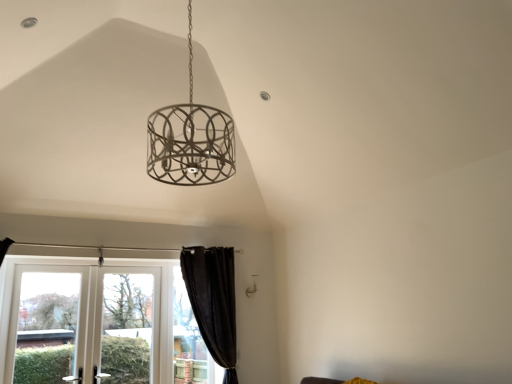
Question: Can you confirm if clear glass screen door at lower left is shorter than black curtain at lower left, acting as the 3th window starting from the left?

Choices:
 (A) no
 (B) yes

Answer: (B)

Question: From a real-world perspective, is clear glass screen door at lower left located higher than black curtain at lower left, acting as the 3th window starting from the left?

Choices:
 (A) yes
 (B) no

Answer: (A)

Question: Can you confirm if clear glass screen door at lower left is taller than black curtain at lower left, which is counted as the first window, starting from the right?

Choices:
 (A) no
 (B) yes

Answer: (A)

Question: Can you confirm if clear glass screen door at lower left is smaller than black curtain at lower left, acting as the 3th window starting from the left?

Choices:
 (A) no
 (B) yes

Answer: (A)

Question: Considering the relative positions of clear glass screen door at lower left and black curtain at lower left, which is counted as the first window, starting from the right, in the image provided, is clear glass screen door at lower left to the right of black curtain at lower left, which is counted as the first window, starting from the right, from the viewer's perspective?

Choices:
 (A) yes
 (B) no

Answer: (B)

Question: Is clear glass screen door at lower left bigger than black curtain at lower left, acting as the 3th window starting from the left?

Choices:
 (A) no
 (B) yes

Answer: (B)

Question: Is clear glass screen door at lower left aimed at black velvet curtain at lower left?

Choices:
 (A) yes
 (B) no

Answer: (B)

Question: Can you confirm if clear glass screen door at lower left is positioned to the left of black velvet curtain at lower left?

Choices:
 (A) yes
 (B) no

Answer: (A)

Question: Does clear glass screen door at lower left have a larger size compared to black velvet curtain at lower left?

Choices:
 (A) yes
 (B) no

Answer: (B)

Question: Is clear glass screen door at lower left in contact with black velvet curtain at lower left?

Choices:
 (A) no
 (B) yes

Answer: (A)

Question: Can you confirm if clear glass screen door at lower left is smaller than black velvet curtain at lower left?

Choices:
 (A) no
 (B) yes

Answer: (B)

Question: From the image's perspective, does clear glass screen door at lower left appear lower than black velvet curtain at lower left?

Choices:
 (A) yes
 (B) no

Answer: (A)

Question: From a real-world perspective, is black curtain at lower left, which is counted as the first window, starting from the right, positioned under clear glass screen door at lower left based on gravity?

Choices:
 (A) no
 (B) yes

Answer: (B)